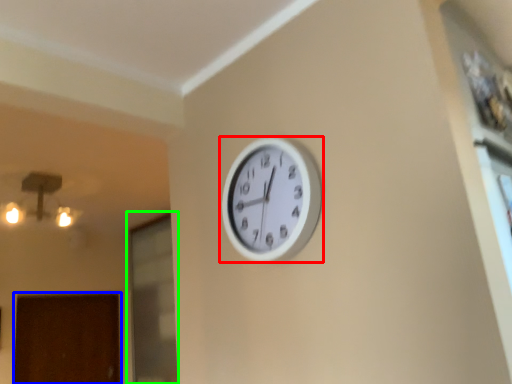
Question: Based on their relative distances, which object is farther from wall clock (highlighted by a red box)? Choose from door (highlighted by a blue box) and glass door (highlighted by a green box).

Choices:
 (A) door
 (B) glass door

Answer: (A)